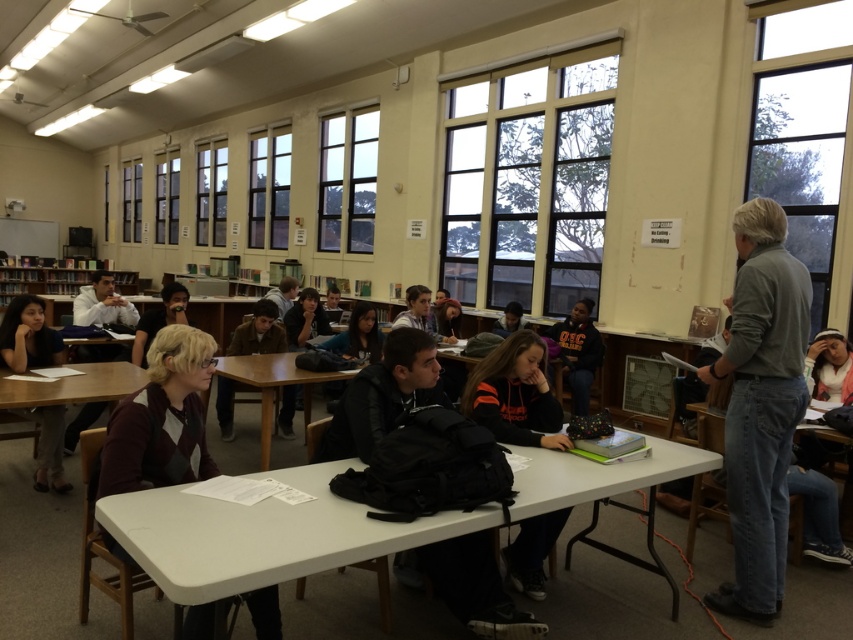
Can you confirm if dark brown hair at lower left is positioned to the right of black fleece hoodie at center?

In fact, dark brown hair at lower left is to the left of black fleece hoodie at center.

Can you confirm if dark brown hair at lower left is thinner than black fleece hoodie at center?

Yes.

Is point (28, 320) less distant than point (572, 326)?

Yes, it is.

Where is `dark brown hair at lower left`? Image resolution: width=853 pixels, height=640 pixels. dark brown hair at lower left is located at coordinates (28, 337).

Does dark brown hair at lower left have a greater width compared to wooden table at center?

No, dark brown hair at lower left is not wider than wooden table at center.

Which is behind, point (19, 342) or point (263, 376)?

Point (263, 376)

The width and height of the screenshot is (853, 640). What do you see at coordinates (28, 337) in the screenshot?
I see `dark brown hair at lower left` at bounding box center [28, 337].

The width and height of the screenshot is (853, 640). Find the location of `dark brown hair at lower left`. dark brown hair at lower left is located at coordinates (28, 337).

I want to click on gray cotton shirt at right, so click(x=759, y=406).

Describe the element at coordinates (759, 406) in the screenshot. I see `gray cotton shirt at right` at that location.

This screenshot has width=853, height=640. In order to click on gray cotton shirt at right in this screenshot , I will do `click(759, 406)`.